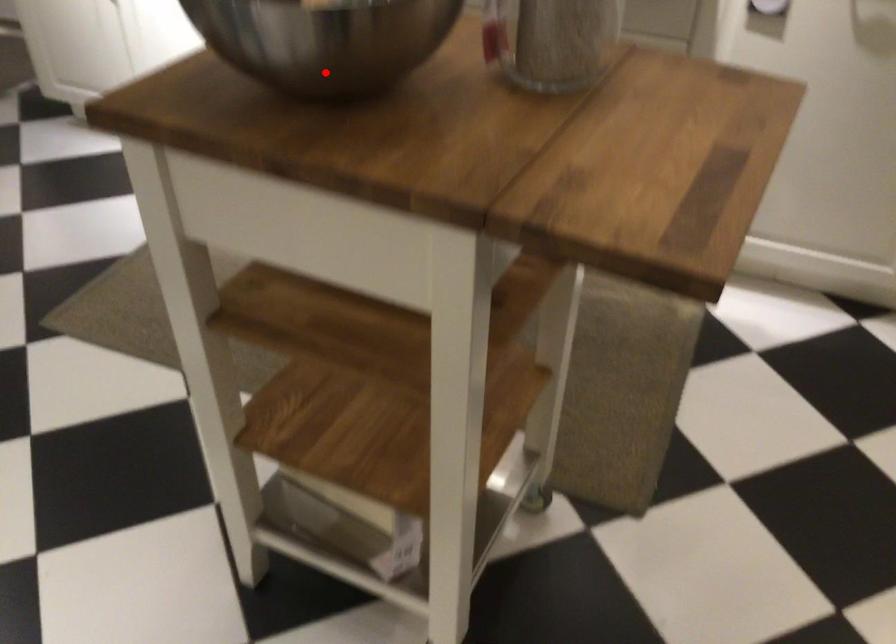
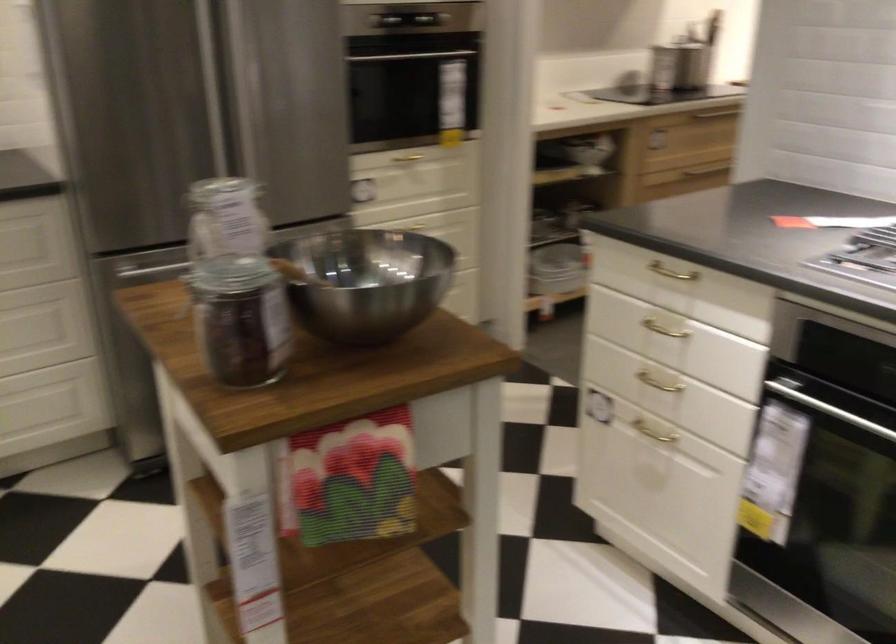
In the second image, find the point that corresponds to the highlighted location in the first image.

(366, 281)